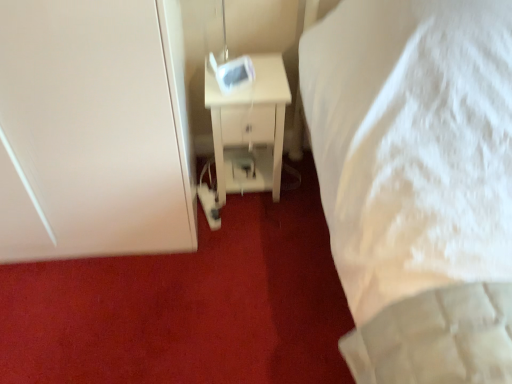
Find the location of a particular element. This screenshot has height=384, width=512. vacant area that is in front of white glossy nightstand at center is located at coordinates (248, 230).